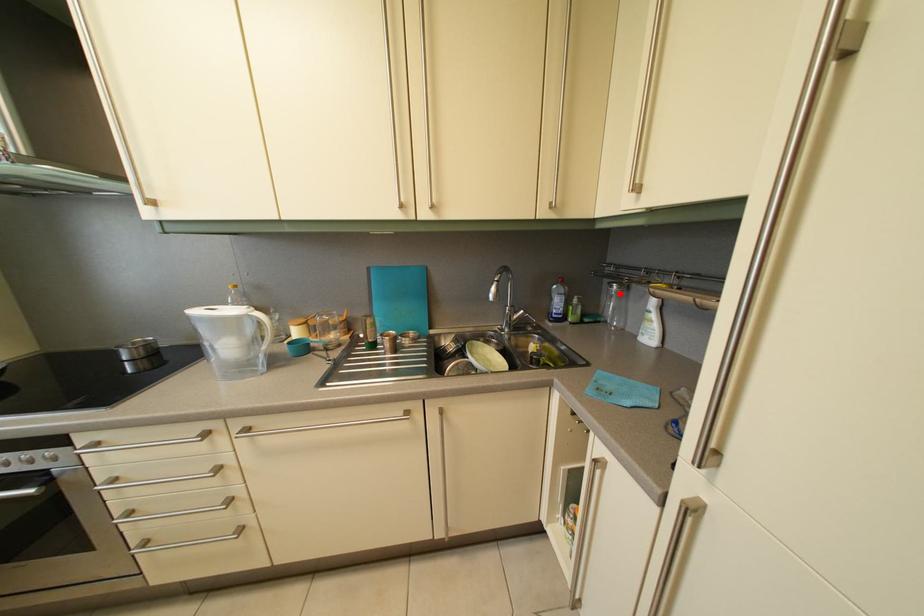
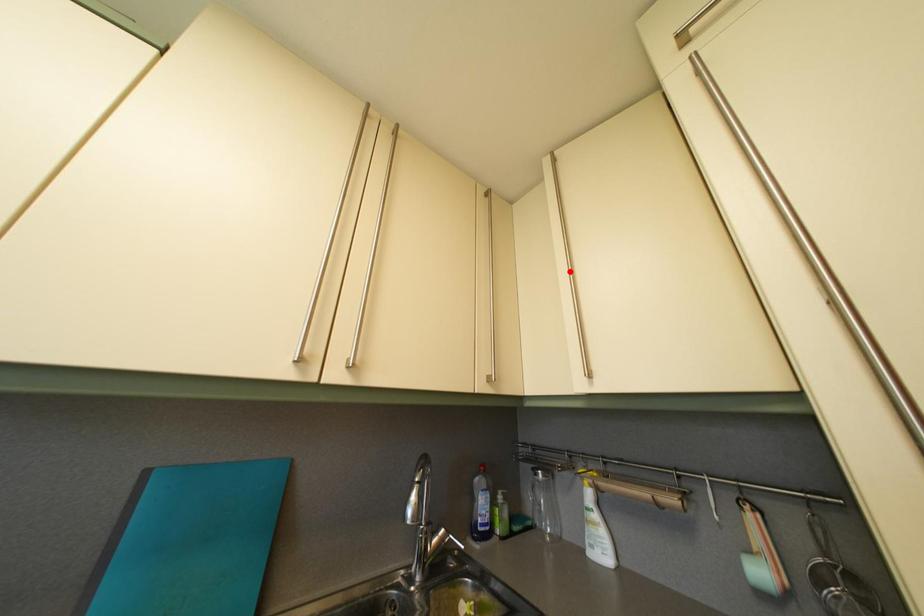
I am providing you with two images of the same scene from different viewpoints. A red point is marked on the first image and another point is marked on the second image. Does the point marked in image1 correspond to the same location as the one in image2?

No